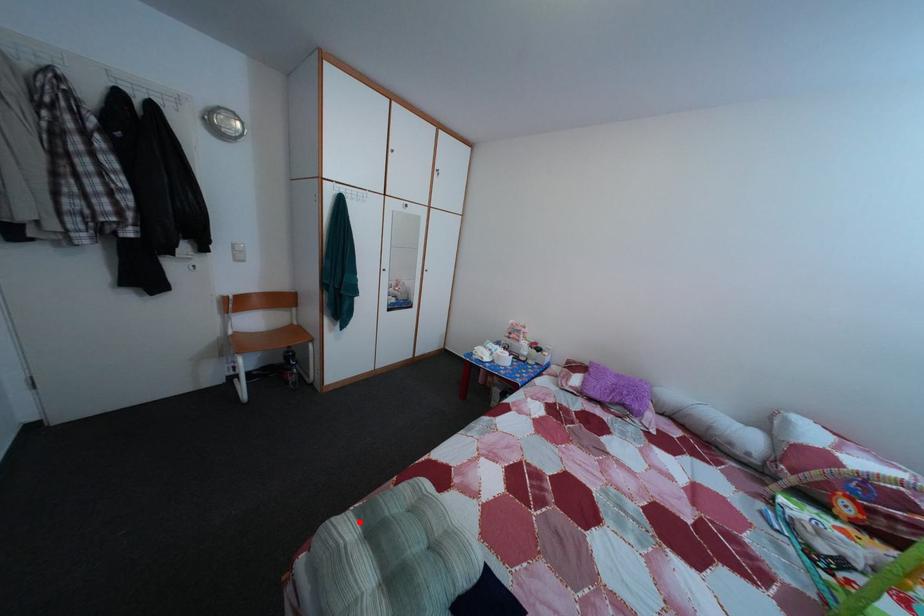
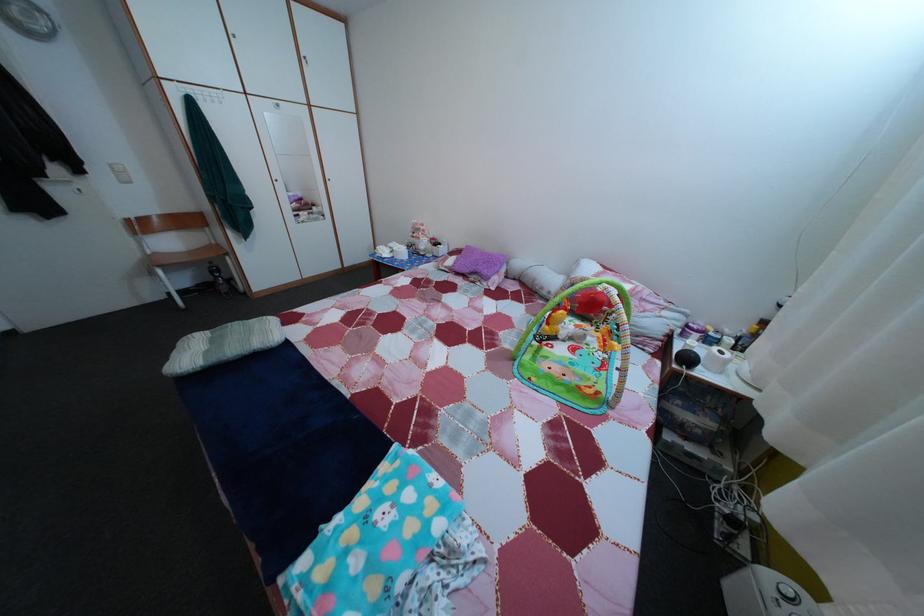
The point at the highlighted location is marked in the first image. Where is the corresponding point in the second image?

(217, 339)